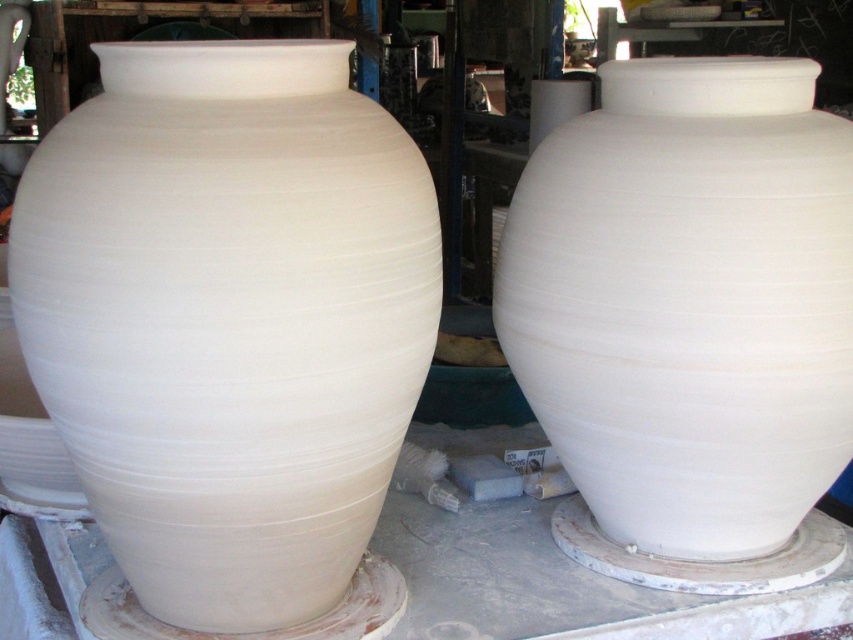
Question: From the image, what is the correct spatial relationship of white clay vase at center in relation to white matte vase at center?

Choices:
 (A) below
 (B) above

Answer: (A)

Question: Which of the following is the farthest from the observer?

Choices:
 (A) (329, 154)
 (B) (793, 470)

Answer: (B)

Question: Can you confirm if white clay vase at center is positioned below white matte vase at center?

Choices:
 (A) yes
 (B) no

Answer: (A)

Question: Can you confirm if white clay vase at center is positioned below white matte vase at center?

Choices:
 (A) no
 (B) yes

Answer: (B)